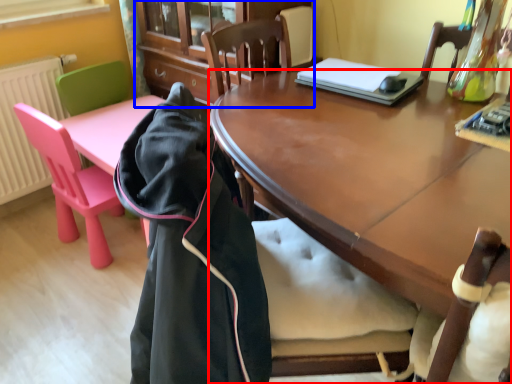
Question: Among these objects, which one is nearest to the camera, desk (highlighted by a red box) or cabinetry (highlighted by a blue box)?

Choices:
 (A) desk
 (B) cabinetry

Answer: (A)